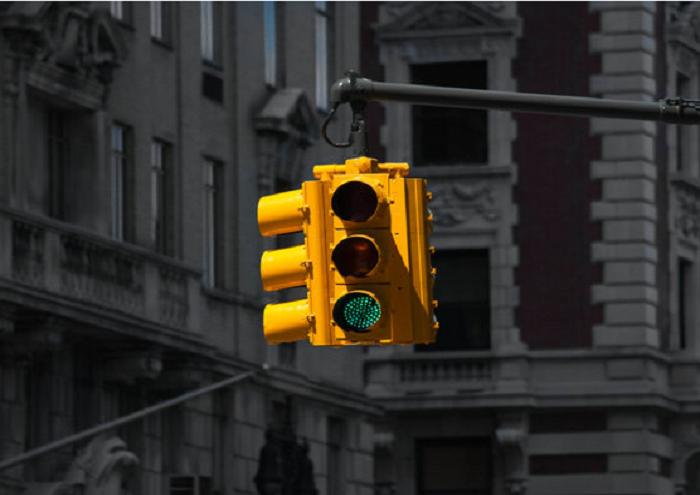
At what (x,y) coordinates should I click in order to perform the action: click on green light. Please return your answer as a coordinate pair (x, y). Looking at the image, I should click on (360, 313).